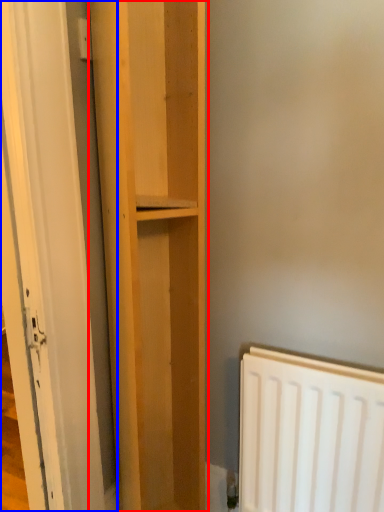
Question: Which of the following is the farthest to the observer, cupboard (highlighted by a red box) or door (highlighted by a blue box)?

Choices:
 (A) cupboard
 (B) door

Answer: (A)